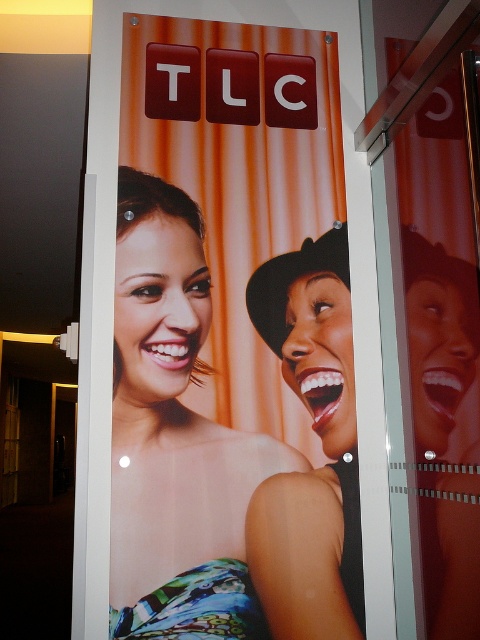
Question: Which point is farther to the camera?

Choices:
 (A) (195, 483)
 (B) (315, 490)

Answer: (B)

Question: Which of the following is the closest to the observer?

Choices:
 (A) (201, 236)
 (B) (301, 298)

Answer: (A)

Question: Which point is closer to the camera?

Choices:
 (A) (326, 257)
 (B) (223, 595)

Answer: (B)

Question: Does matte skin tone woman at center come in front of smooth black hat at right?

Choices:
 (A) yes
 (B) no

Answer: (A)

Question: Does matte skin tone woman at center have a greater width compared to smooth black hat at right?

Choices:
 (A) yes
 (B) no

Answer: (A)

Question: Observing the image, what is the correct spatial positioning of matte skin tone woman at center in reference to smooth black hat at right?

Choices:
 (A) left
 (B) right

Answer: (A)